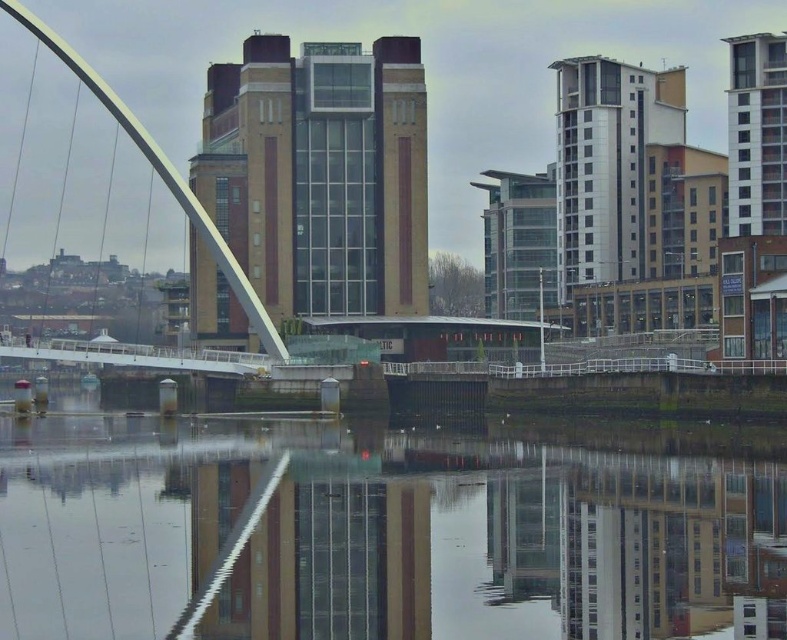
You are a city planner evaluating the urban layout. Based on the scene, which object is positioned lower in the image, the transparent glass water at center or the white glossy arch bridge at left?

The transparent glass water at center is located below the white glossy arch bridge at left, so it is positioned lower in the image.

You are an architect analyzing the urban layout. The city plans to install a new lamppost at point 0.841, 0.488. However, there is a transparent glass water at center at that location. What potential issue might arise from placing the lamppost there?

The transparent glass water at center is located at point (383,538). Installing a lamppost there would interfere with the water feature, possibly disrupting its reflective properties or causing safety hazards due to the water being in that area.